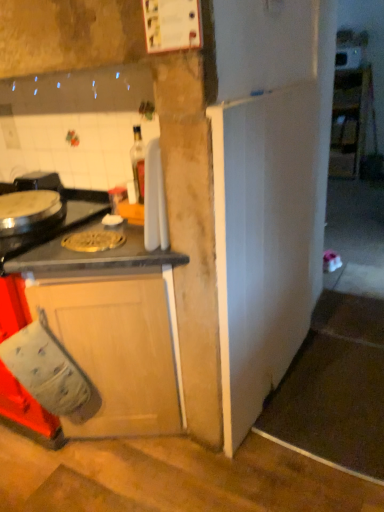
Question: In terms of size, does wooden cabinet at lower left, acting as the second cabinetry starting from the back, appear bigger or smaller than gold metallic pizza pan at center?

Choices:
 (A) big
 (B) small

Answer: (A)

Question: Is point (144, 394) positioned closer to the camera than point (87, 243)?

Choices:
 (A) closer
 (B) farther

Answer: (B)

Question: Considering the real-world distances, which object is closest to the wooden cabinet at lower left, the 1th cabinetry viewed from the left?

Choices:
 (A) white glossy cabinet at upper right, marked as the second cabinetry in a left-to-right arrangement
 (B) gold metallic pizza pan at center
 (C) white glossy microwave at upper right
 (D) shiny metallic burner at left

Answer: (B)

Question: Considering the real-world distances, which object is closest to the shiny metallic burner at left?

Choices:
 (A) wooden cabinet at lower left, the 1th cabinetry viewed from the left
 (B) gold metallic pizza pan at center
 (C) white glossy cabinet at upper right, marked as the second cabinetry in a left-to-right arrangement
 (D) white glossy microwave at upper right

Answer: (B)